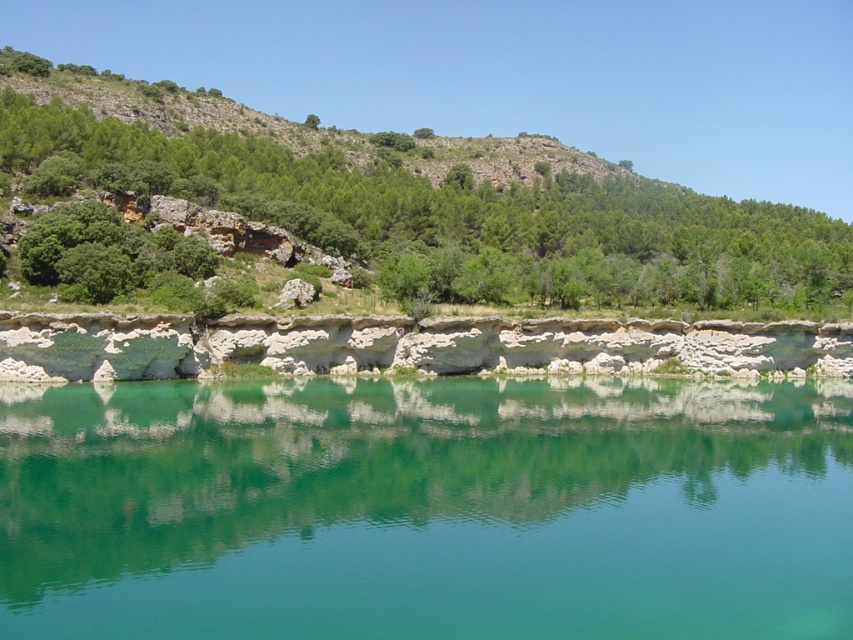
Is green smooth water at center behind green leafy hillside at upper left?

No, green smooth water at center is in front of green leafy hillside at upper left.

From the picture: Who is lower down, green smooth water at center or green leafy hillside at upper left?

green smooth water at center

Who is more forward, (x=508, y=554) or (x=126, y=132)?

Point (x=508, y=554) is more forward.

You are a GUI agent. You are given a task and a screenshot of the screen. Output one action in this format:
    pyautogui.click(x=<x>, y=<y>)
    Task: Click on the green smooth water at center
    The image size is (853, 640).
    Given the screenshot: What is the action you would take?
    pyautogui.click(x=426, y=509)